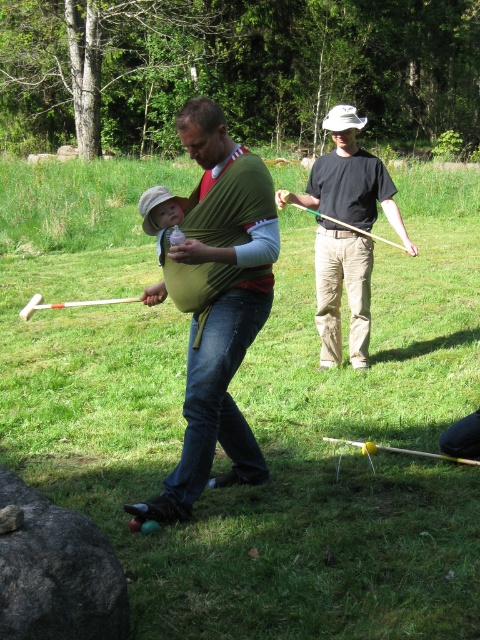
Who is positioned more to the left, green fabric baby carrier at center or black cotton shirt at center?

green fabric baby carrier at center is more to the left.

Which is more to the right, green fabric baby carrier at center or black cotton shirt at center?

black cotton shirt at center

Which is behind, point (215, 349) or point (354, 275)?

Point (354, 275)

You are a GUI agent. You are given a task and a screenshot of the screen. Output one action in this format:
    pyautogui.click(x=<x>, y=<y>)
    Task: Click on the green fabric baby carrier at center
    The image size is (480, 640).
    Given the screenshot: What is the action you would take?
    pyautogui.click(x=216, y=305)